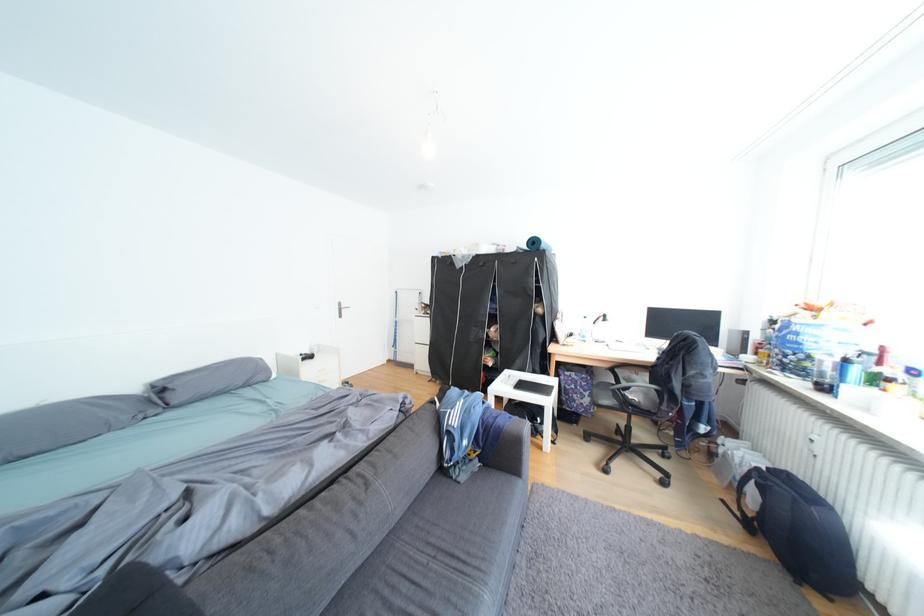
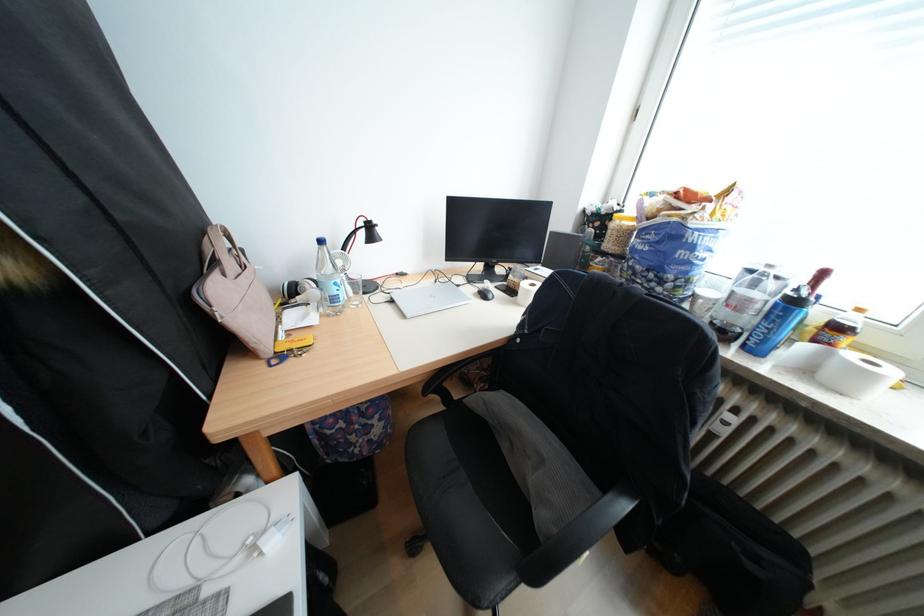
Find the pixel in the second image that matches pixel 597 338 in the first image.

(346, 300)